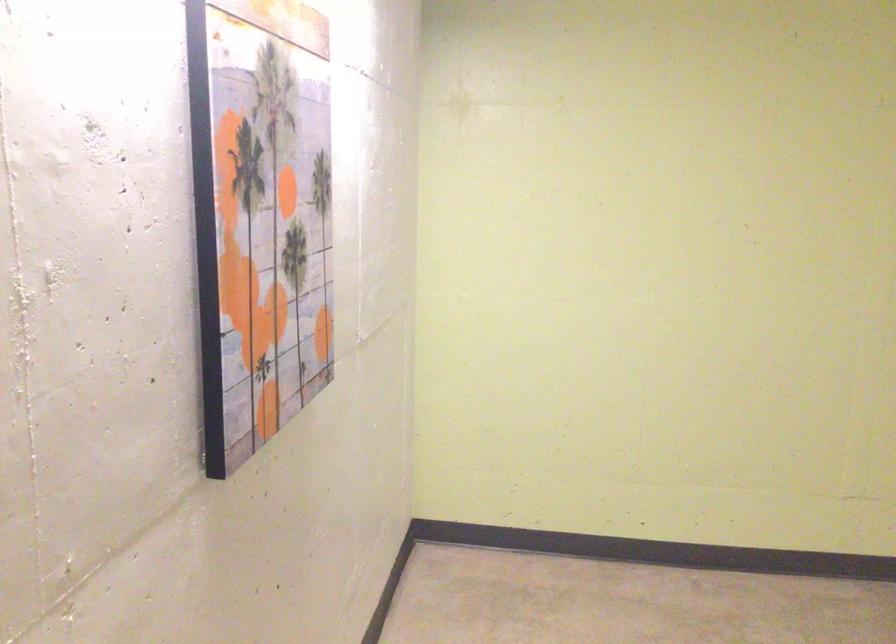
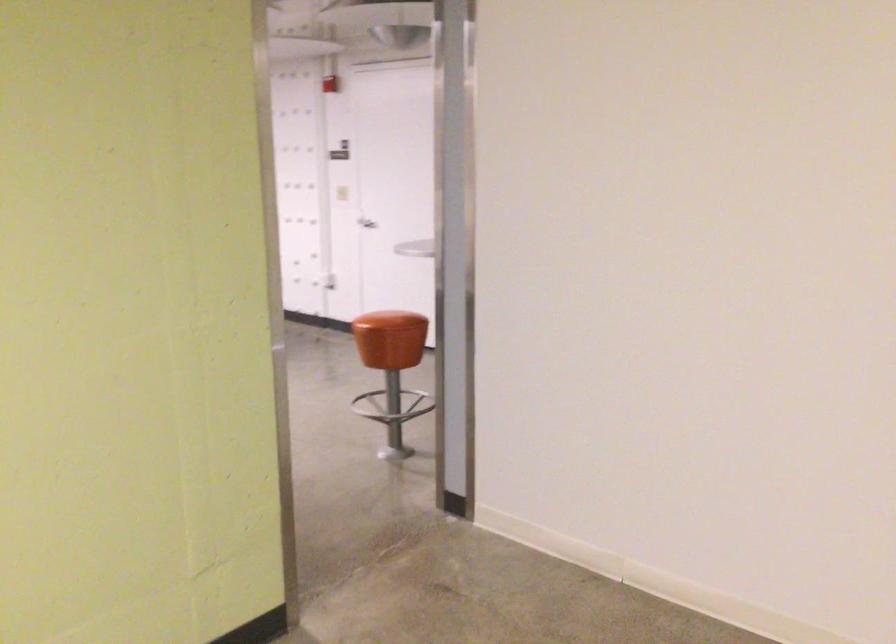
Question: How did the camera likely rotate?

Choices:
 (A) Left
 (B) Right
 (C) Up
 (D) Down

Answer: (B)